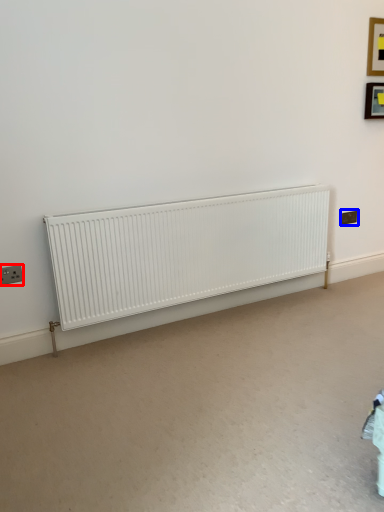
Question: Which of the following is the closest to the observer, electric outlet (highlighted by a red box) or electric outlet (highlighted by a blue box)?

Choices:
 (A) electric outlet
 (B) electric outlet

Answer: (A)